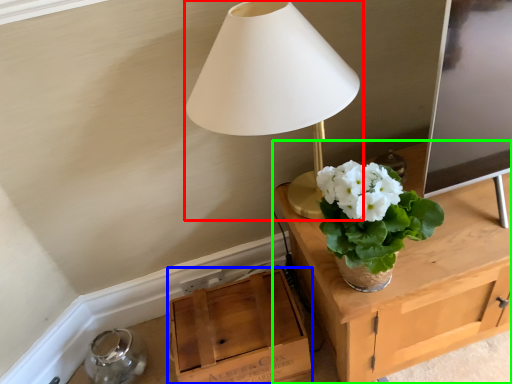
Question: Which object is the closest to the lamp (highlighted by a red box)? Choose among these: cardboard box (highlighted by a blue box) or table (highlighted by a green box).

Choices:
 (A) cardboard box
 (B) table

Answer: (B)